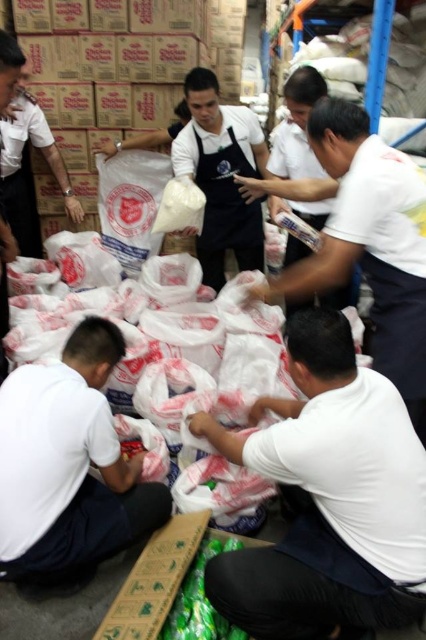
You are a volunteer in the warehouse and need to determine if the white matte plastic bag at upper center can fit through a narrow doorway that is only as wide as the black matte apron at center. Can it fit?

The white matte plastic bag at upper center might be wider than the black matte apron at center, so it may not fit through the doorway that is only as wide as the apron.

You are a volunteer in the warehouse and need to move a box from point A to point B. Point A is at coordinate point(360,136) and point B is at coordinate point(199,113). Which point is closer to you when standing at the entrance?

Point A at coordinate point(360,136) is closer to you than point B at coordinate point(199,113) because it is in front of point B.

You are a volunteer in the warehouse and need to place a new box of supplies at point (69, 465). However, there is an object already there. What is the object at that point?

The object at point (69, 465) is the white plastic bag at lower left.